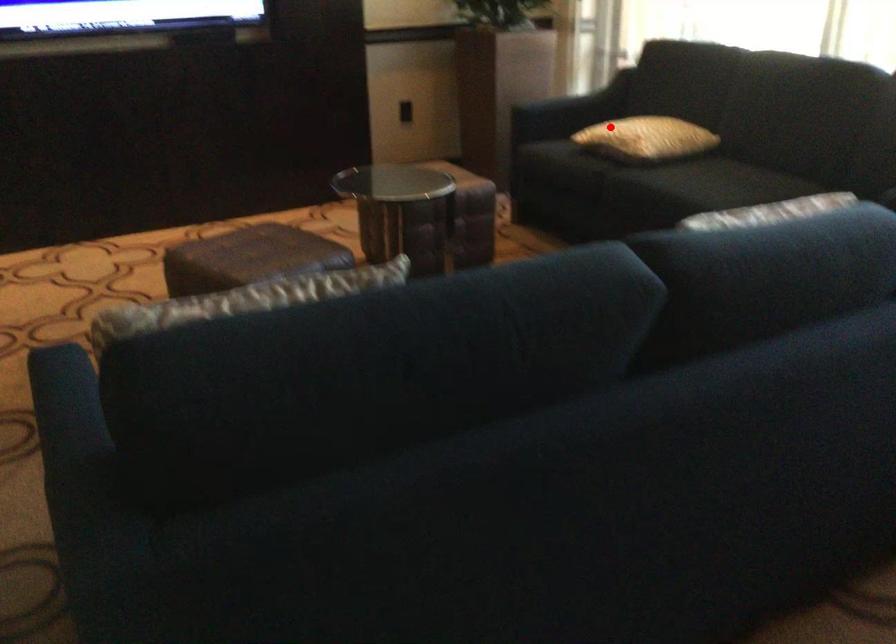
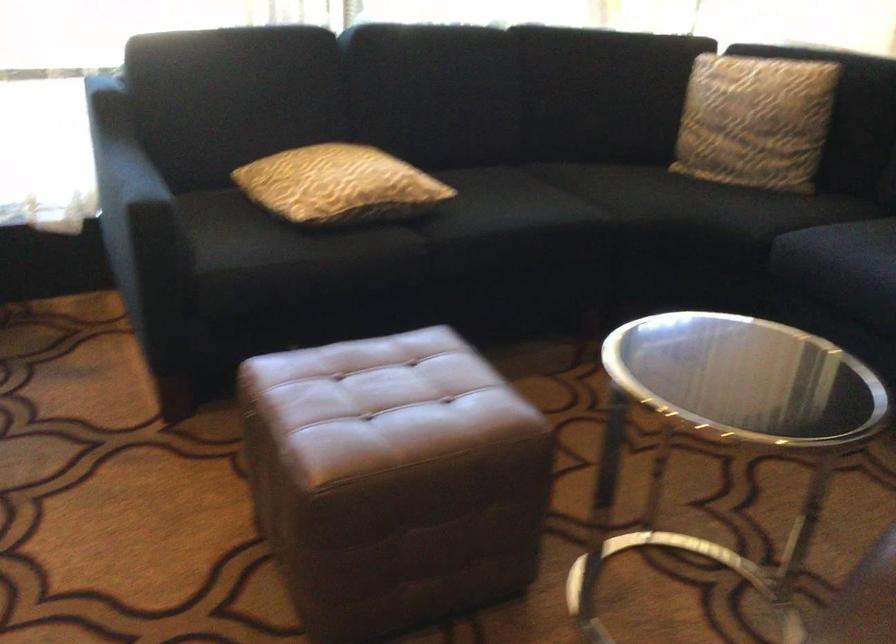
Question: I am providing you with two images of the same scene from different viewpoints. In image1, a red point is highlighted. Considering the same 3D point in image2, which of the following is correct?

Choices:
 (A) It is closer
 (B) It is farther

Answer: (A)